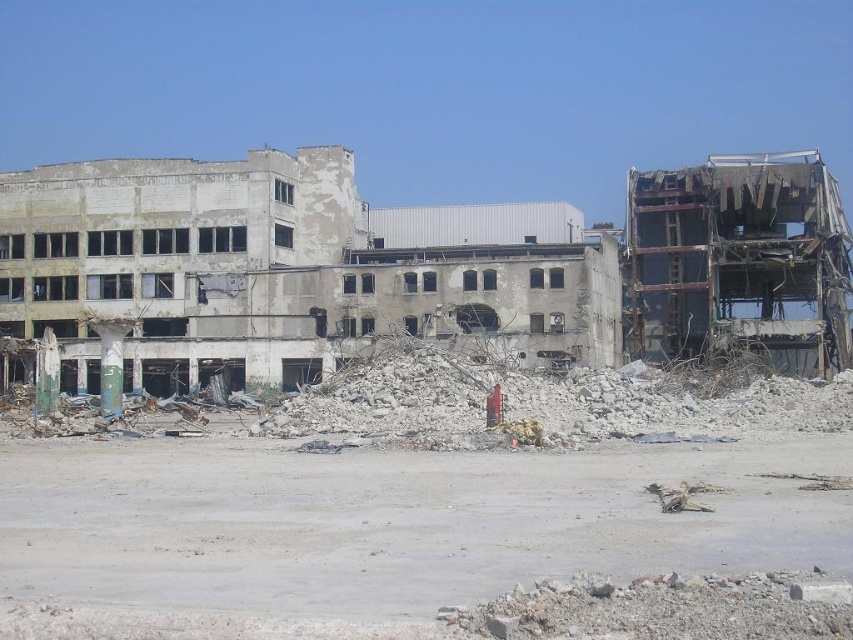
Question: Does gray rubble at center appear on the left side of gray concrete rubble at center?

Choices:
 (A) yes
 (B) no

Answer: (B)

Question: Is gray rubble at center wider than gray concrete rubble at center?

Choices:
 (A) yes
 (B) no

Answer: (B)

Question: Observing the image, what is the correct spatial positioning of gray rubble at center in reference to gray concrete rubble at center?

Choices:
 (A) right
 (B) left

Answer: (A)

Question: Which object is farther from the camera taking this photo?

Choices:
 (A) gray concrete rubble at center
 (B) gray rubble at center

Answer: (A)

Question: Which point is closer to the camera taking this photo?

Choices:
 (A) (183, 568)
 (B) (181, 176)

Answer: (A)

Question: Among these objects, which one is farthest from the camera?

Choices:
 (A) gray concrete rubble at center
 (B) gray rubble at center

Answer: (A)